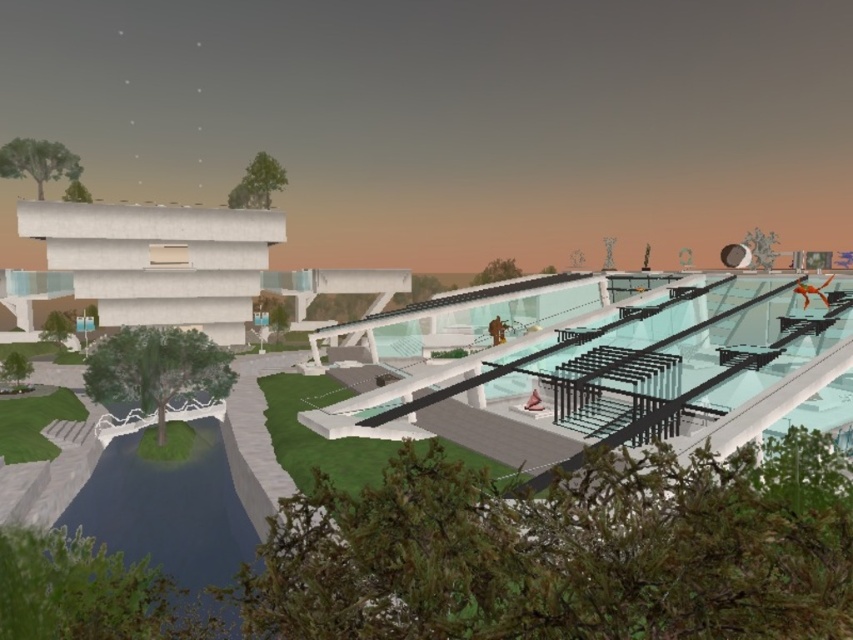
Does clear glass water park at center come in front of blue glass pool at lower left?

Yes, it is.

Who is higher up, clear glass water park at center or blue glass pool at lower left?

clear glass water park at center

Which is behind, point (845, 413) or point (97, 502)?

The point (845, 413) is behind.

Find the location of a particular element. clear glass water park at center is located at coordinates (642, 371).